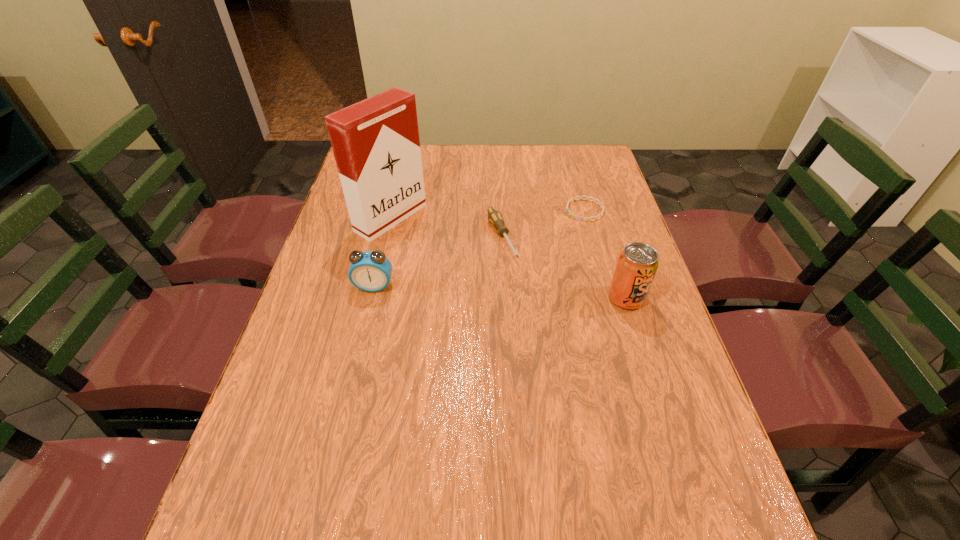
Identify the location of the third shortest object. (370, 271).

In order to click on the second tallest object in this screenshot , I will do `click(637, 264)`.

Locate an element on the screen. The height and width of the screenshot is (540, 960). the shortest object is located at coordinates (580, 197).

I want to click on cigarette_case, so click(376, 145).

You are a GUI agent. You are given a task and a screenshot of the screen. Output one action in this format:
    pyautogui.click(x=<x>, y=<y>)
    Task: Click on the screwdriver
    The height and width of the screenshot is (540, 960).
    Given the screenshot: What is the action you would take?
    pyautogui.click(x=494, y=216)

You are a GUI agent. You are given a task and a screenshot of the screen. Output one action in this format:
    pyautogui.click(x=<x>, y=<y>)
    Task: Click on the second shortest object
    This screenshot has width=960, height=540.
    Given the screenshot: What is the action you would take?
    pyautogui.click(x=494, y=216)

The image size is (960, 540). I want to click on vacant space located 0.320m on the face of the alarm clock, so click(x=346, y=405).

The height and width of the screenshot is (540, 960). I want to click on free space located on the front of the fourth shortest object, so click(667, 430).

At what (x,y) coordinates should I click in order to perform the action: click on vacant area located 0.340m on the surface of the shortest object showing star-shaped elements. Please return your answer as a coordinate pair (x, y). The image size is (960, 540). Looking at the image, I should click on (496, 271).

In order to click on vacant position located 0.240m on the surface of the shortest object showing star-shaped elements in this screenshot , I will do `click(520, 254)`.